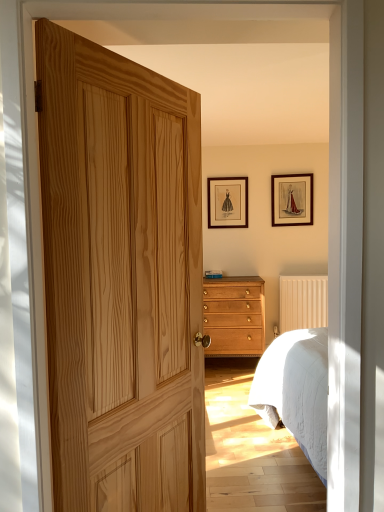
Question: Visually, is light brown wood chest of drawers at center positioned to the left or to the right of natural wood door at center?

Choices:
 (A) left
 (B) right

Answer: (B)

Question: Looking at their shapes, would you say light brown wood chest of drawers at center is wider or thinner than natural wood door at center?

Choices:
 (A) wide
 (B) thin

Answer: (A)

Question: Based on their relative distances, which object is nearer to the light brown wood chest of drawers at center?

Choices:
 (A) beige textured radiator at center right
 (B) matte black picture frame at upper center, which is the 1th picture frame from left to right
 (C) wooden picture frame at upper right, acting as the 1th picture frame starting from the right
 (D) natural wood door at center

Answer: (A)

Question: Which object is positioned closest to the beige textured radiator at center right?

Choices:
 (A) wooden picture frame at upper right, acting as the 1th picture frame starting from the right
 (B) light brown wood chest of drawers at center
 (C) matte black picture frame at upper center, marked as the second picture frame in a right-to-left arrangement
 (D) natural wood door at center

Answer: (B)